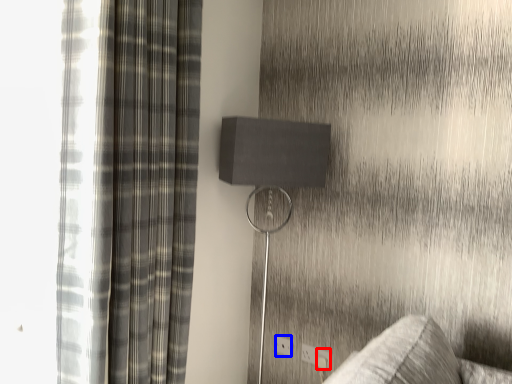
Question: Among these objects, which one is farthest to the camera, electric outlet (highlighted by a red box) or electric outlet (highlighted by a blue box)?

Choices:
 (A) electric outlet
 (B) electric outlet

Answer: (B)